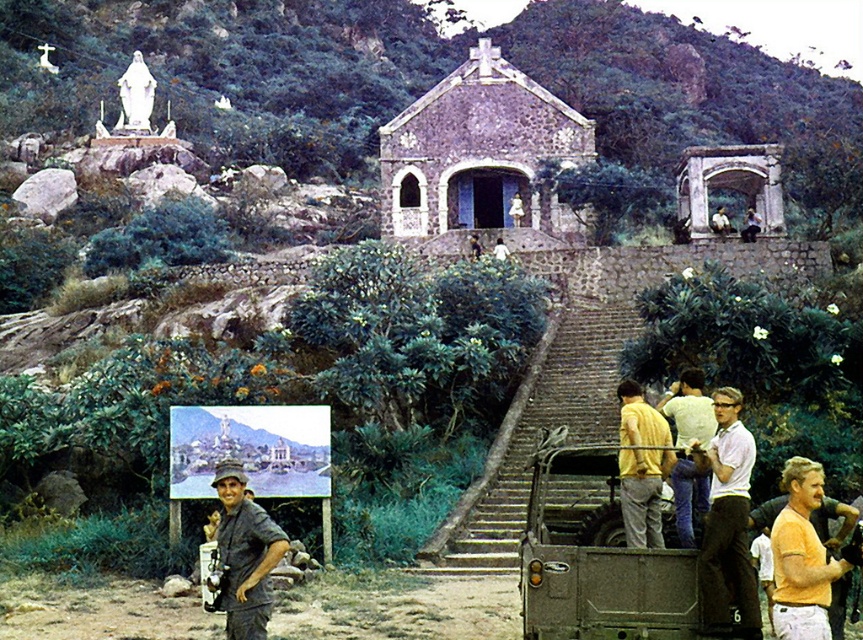
Consider the image. You are a photographer trying to arrange two models wearing the white matte shirt at center right and the yellow shirt at center so that they appear balanced in the frame. Which model should you place closer to the edge of the frame to achieve this balance?

To balance the frame, the white matte shirt at center right should be placed closer to the edge since it is thinner than the yellow shirt at center, which is wider. This arrangement helps distribute visual weight evenly.

You are a photographer trying to capture a clear shot of the camouflage fabric truck at center and the yellow shirt at center. Which object is narrower in the scene?

The camouflage fabric truck at center is thinner than the yellow shirt at center, so the camouflage fabric truck at center is narrower.

You are an artist trying to sketch the scene. You want to place the white matte shirt at center right in your drawing. Where should you position it on your canvas using the coordinate system where the bottom left corner is 0,0 and the top right corner is 1,1?

You should position the white matte shirt at center right at coordinate point (728,522) on your canvas.